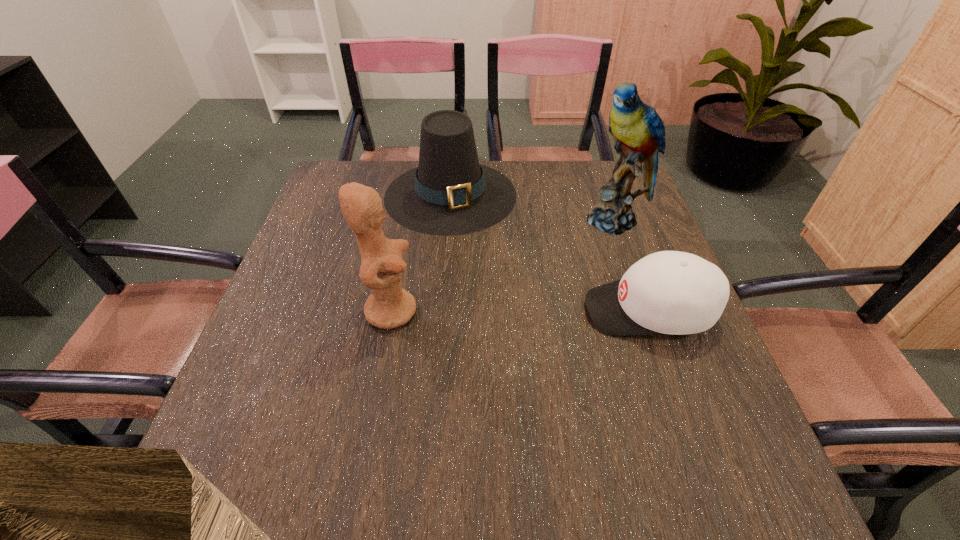
The width and height of the screenshot is (960, 540). I want to click on vacant space in between the parrot and the figurine, so coord(504,265).

The image size is (960, 540). What are the coordinates of `unoccupied position between the shortest object and the second tallest object` in the screenshot? It's located at (520, 310).

Locate an element on the screen. This screenshot has height=540, width=960. vacant region between the hat and the figurine is located at coordinates (420, 253).

This screenshot has width=960, height=540. Identify the location of free area in between the second shortest object and the tallest object. click(534, 207).

Where is `the closest object to the parrot`? the closest object to the parrot is located at coordinates (669, 292).

Image resolution: width=960 pixels, height=540 pixels. Identify the location of object identified as the closest to the baseball cap. (638, 131).